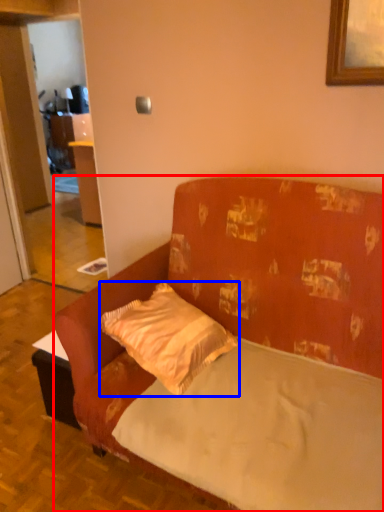
Question: Which object appears closest to the camera in this image, studio couch (highlighted by a red box) or pillow (highlighted by a blue box)?

Choices:
 (A) studio couch
 (B) pillow

Answer: (A)